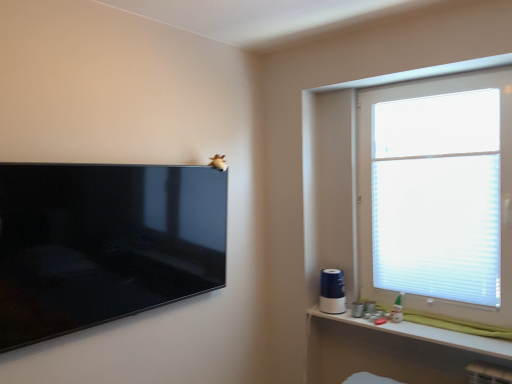
This screenshot has height=384, width=512. I want to click on white plastic shelf at lower right, so click(426, 334).

What do you see at coordinates (426, 334) in the screenshot? I see `white plastic shelf at lower right` at bounding box center [426, 334].

You are a GUI agent. You are given a task and a screenshot of the screen. Output one action in this format:
    pyautogui.click(x=<x>, y=<y>)
    Task: Click on the matte black tv at upper left
    Image resolution: width=512 pixels, height=384 pixels.
    Given the screenshot: What is the action you would take?
    pyautogui.click(x=104, y=243)

Locate an element on the screen. white translucent blinds at upper right is located at coordinates (438, 194).

Is point (489, 346) positioned after point (404, 235)?

No.

Between white plastic shelf at lower right and white translucent blinds at upper right, which one appears on the left side from the viewer's perspective?

Positioned to the left is white plastic shelf at lower right.

Between white plastic shelf at lower right and white translucent blinds at upper right, which one has less height?

Standing shorter between the two is white plastic shelf at lower right.

Is white plastic shelf at lower right not within white translucent blinds at upper right?

Absolutely, white plastic shelf at lower right is external to white translucent blinds at upper right.

Which of these two, white translucent blinds at upper right or matte black tv at upper left, stands taller?

white translucent blinds at upper right.

Is matte black tv at upper left a part of white translucent blinds at upper right?

No, matte black tv at upper left is not inside white translucent blinds at upper right.

Where is `television in front of the white translucent blinds at upper right`? The image size is (512, 384). television in front of the white translucent blinds at upper right is located at coordinates (104, 243).

Which point is more forward, (x=350, y=311) or (x=60, y=303)?

The point (x=60, y=303) is in front.

Which object is further away from the camera, white plastic shelf at lower right or matte black tv at upper left?

white plastic shelf at lower right is further away from the camera.

Is white plastic shelf at lower right spatially inside matte black tv at upper left, or outside of it?

white plastic shelf at lower right cannot be found inside matte black tv at upper left.

Locate an element on the screen. shelf directly beneath the matte black tv at upper left (from a real-world perspective) is located at coordinates (426, 334).

Is white plastic shelf at lower right at the back of white translucent blinds at upper right?

No, white translucent blinds at upper right's orientation is not away from white plastic shelf at lower right.

I want to click on window above the white plastic shelf at lower right (from a real-world perspective), so click(438, 194).

In the scene shown: Is white translucent blinds at upper right in front of white plastic shelf at lower right?

No.

From the image's perspective, which is below, white translucent blinds at upper right or white plastic shelf at lower right?

From the image's view, white plastic shelf at lower right is below.

Find the location of a particular element. The image size is (512, 384). shelf lying behind the matte black tv at upper left is located at coordinates (426, 334).

Which of these two, matte black tv at upper left or white plastic shelf at lower right, is wider?

white plastic shelf at lower right is wider.

Consider the image. What's the angular difference between matte black tv at upper left and white plastic shelf at lower right's facing directions?

They differ by 89.9 degrees in their facing directions.

Considering the positions of point (49, 338) and point (378, 330), is point (49, 338) closer or farther from the camera than point (378, 330)?

Point (49, 338) appears to be closer to the viewer than point (378, 330).

Who is bigger, matte black tv at upper left or white translucent blinds at upper right?

white translucent blinds at upper right is bigger.

Considering the positions of objects matte black tv at upper left and white translucent blinds at upper right in the image provided, who is more to the left, matte black tv at upper left or white translucent blinds at upper right?

From the viewer's perspective, matte black tv at upper left appears more on the left side.

Looking at this image, how different are the orientations of matte black tv at upper left and white translucent blinds at upper right in degrees?

The angular difference between matte black tv at upper left and white translucent blinds at upper right is 89.8 degrees.

Where is `window on the right of the white plastic shelf at lower right`? window on the right of the white plastic shelf at lower right is located at coordinates (438, 194).

Where is `television on the left of white translucent blinds at upper right`? This screenshot has height=384, width=512. television on the left of white translucent blinds at upper right is located at coordinates (104, 243).

Looking at the image, which one is located further to matte black tv at upper left, white translucent blinds at upper right or white plastic shelf at lower right?

white translucent blinds at upper right is further to matte black tv at upper left.

Estimate the real-world distances between objects in this image. Which object is closer to white plastic shelf at lower right, matte black tv at upper left or white translucent blinds at upper right?

The object closer to white plastic shelf at lower right is white translucent blinds at upper right.

Which object lies nearer to the anchor point white translucent blinds at upper right, white plastic shelf at lower right or matte black tv at upper left?

white plastic shelf at lower right is positioned closer to the anchor white translucent blinds at upper right.

From the image, which object appears to be nearer to white plastic shelf at lower right, white translucent blinds at upper right or matte black tv at upper left?

white translucent blinds at upper right lies closer to white plastic shelf at lower right than the other object.

Which object lies further to the anchor point matte black tv at upper left, white plastic shelf at lower right or white translucent blinds at upper right?

Based on the image, white translucent blinds at upper right appears to be further to matte black tv at upper left.

Which object lies further to the anchor point white translucent blinds at upper right, matte black tv at upper left or white plastic shelf at lower right?

matte black tv at upper left.

The image size is (512, 384). Find the location of `shelf between matte black tv at upper left and white translucent blinds at upper right in the horizontal direction`. shelf between matte black tv at upper left and white translucent blinds at upper right in the horizontal direction is located at coordinates (426, 334).